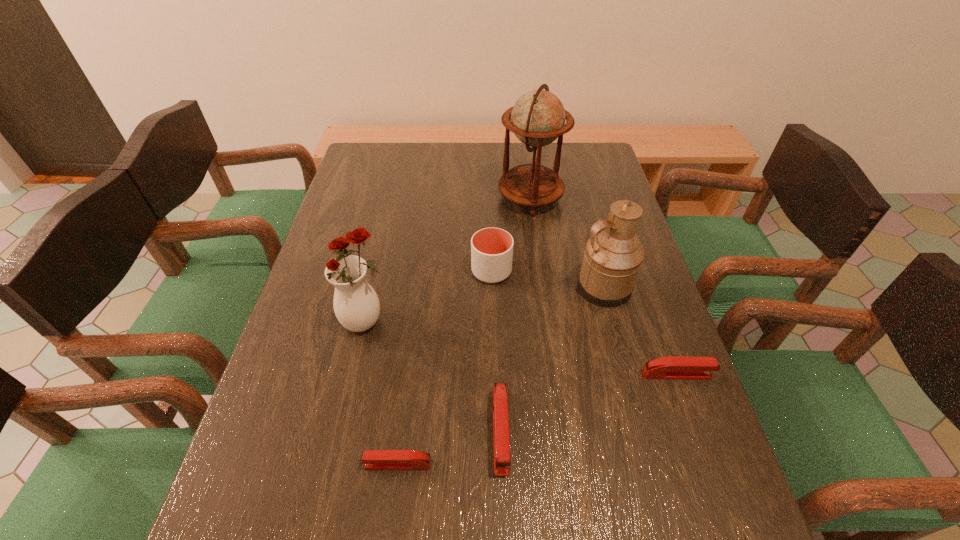
Locate an element on the screen. empty space between the shortest object and the pitcher is located at coordinates (501, 376).

In order to click on unoccupied area between the shortest stapler and the pitcher in this screenshot , I will do `click(501, 376)`.

Where is `free space between the cup and the shortest object`? The width and height of the screenshot is (960, 540). free space between the cup and the shortest object is located at coordinates (444, 368).

Image resolution: width=960 pixels, height=540 pixels. In order to click on vacant space in between the rightmost stapler and the second stapler from left to right in this screenshot , I will do `click(588, 403)`.

Identify the location of vacant space in between the pitcher and the shortest object. This screenshot has width=960, height=540. (501, 376).

Image resolution: width=960 pixels, height=540 pixels. I want to click on object that is the third closest one to the vase, so click(501, 438).

Image resolution: width=960 pixels, height=540 pixels. I want to click on object that stands as the fifth closest to the cup, so click(x=672, y=367).

This screenshot has height=540, width=960. Identify the location of the second closest stapler to the farthest stapler. (373, 459).

The width and height of the screenshot is (960, 540). I want to click on stapler identified as the second closest to the second shortest stapler, so click(x=373, y=459).

Locate an element on the screen. The height and width of the screenshot is (540, 960). vacant space that satisfies the following two spatial constraints: 1. on the surface of the globe; 2. on the right side of the pitcher is located at coordinates (542, 287).